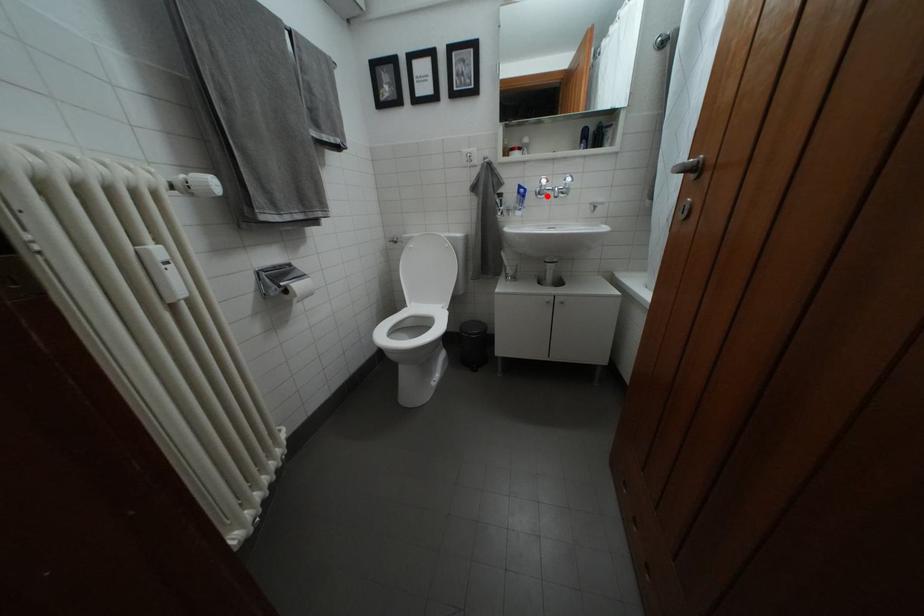
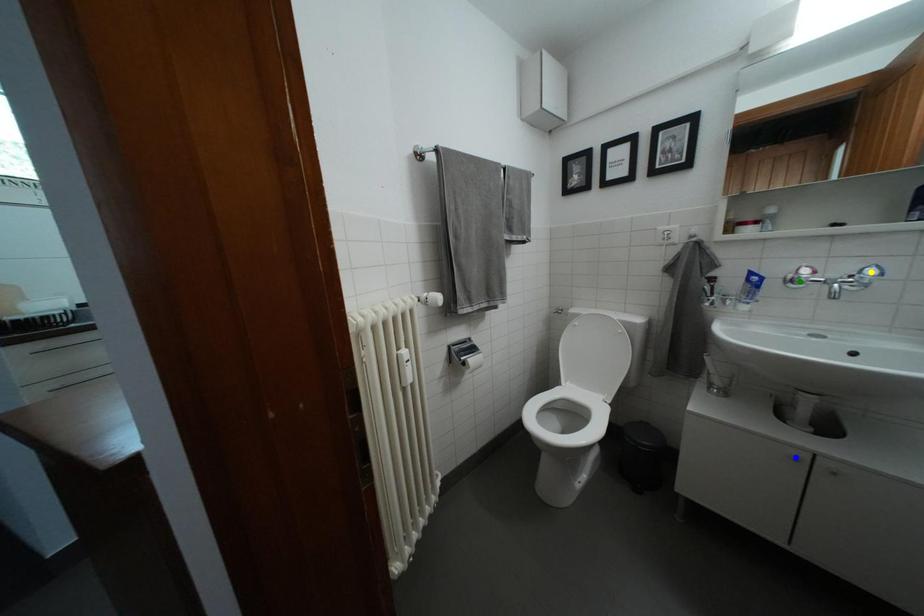
Question: I am providing you with two images of the same scene from different viewpoints. A red point is marked on the first image. You are given multiple points on the second image. Can you choose the point in image 2 that corresponds to the point in image 1?

Choices:
 (A) blue point
 (B) yellow point
 (C) green point

Answer: (C)